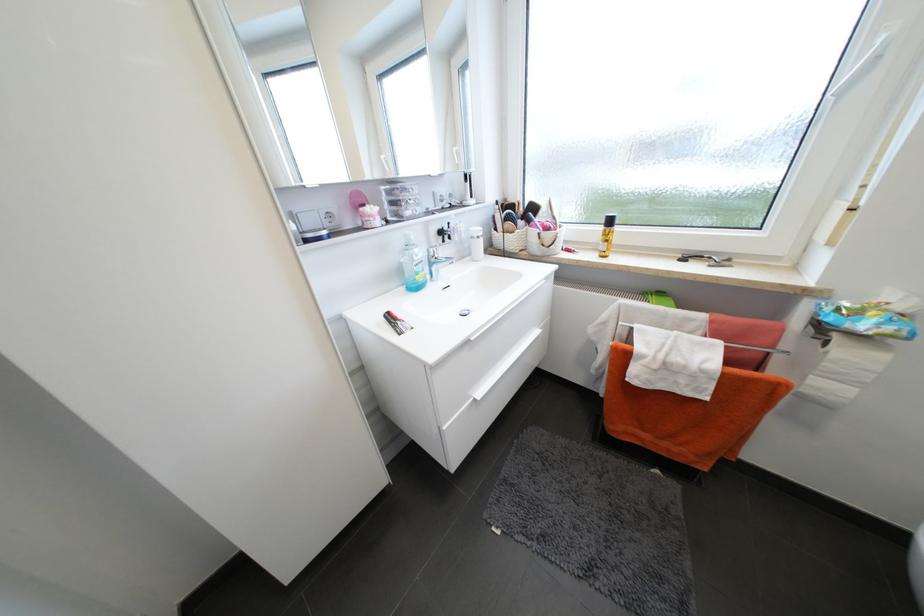
Locate an element on the screen. The height and width of the screenshot is (616, 924). white wicker basket is located at coordinates (543, 241).